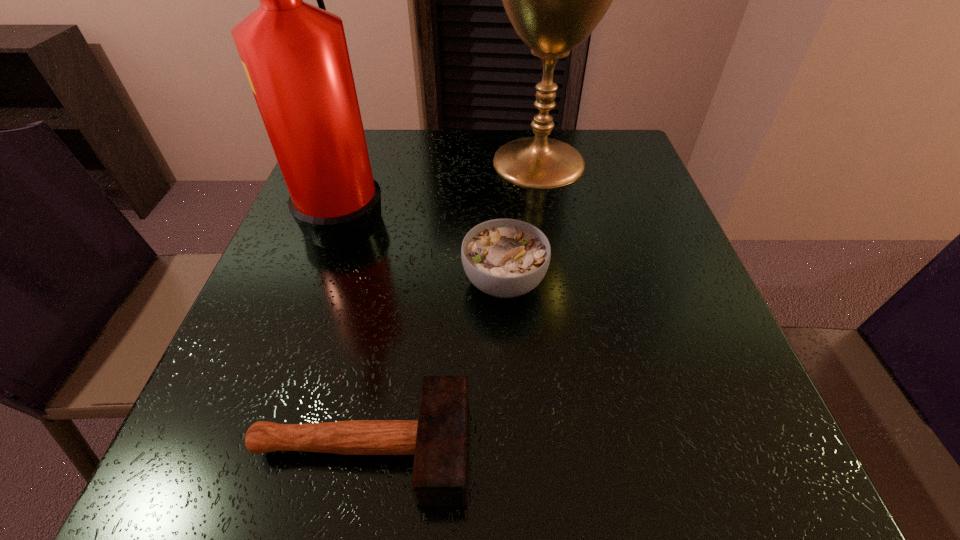
In the image, there is a desktop. Where is `vacant region at the left edge`? Image resolution: width=960 pixels, height=540 pixels. vacant region at the left edge is located at coordinates (207, 436).

Image resolution: width=960 pixels, height=540 pixels. I want to click on vacant area at the right edge, so click(x=632, y=202).

Image resolution: width=960 pixels, height=540 pixels. Find the location of `vacant region at the far left corner of the desktop`. vacant region at the far left corner of the desktop is located at coordinates (379, 142).

This screenshot has width=960, height=540. Identify the location of vacant space at the far right corner of the desktop. (621, 141).

At what (x,y) coordinates should I click in order to perform the action: click on free region at the near right corner. Please return your answer as a coordinate pair (x, y). The width and height of the screenshot is (960, 540). Looking at the image, I should click on (683, 504).

Where is `free space between the third tallest object and the nearest object`? The width and height of the screenshot is (960, 540). free space between the third tallest object and the nearest object is located at coordinates (433, 364).

At what (x,y) coordinates should I click in order to perform the action: click on empty space that is in between the second shortest object and the shortest object. Please return your answer as a coordinate pair (x, y). Looking at the image, I should click on (433, 364).

What are the coordinates of `free space between the trophy cup and the fire extinguisher` in the screenshot? It's located at (443, 187).

The height and width of the screenshot is (540, 960). Find the location of `free area in between the nearest object and the fire extinguisher`. free area in between the nearest object and the fire extinguisher is located at coordinates (354, 329).

Locate an element on the screen. The height and width of the screenshot is (540, 960). free space between the fire extinguisher and the nearest object is located at coordinates click(354, 329).